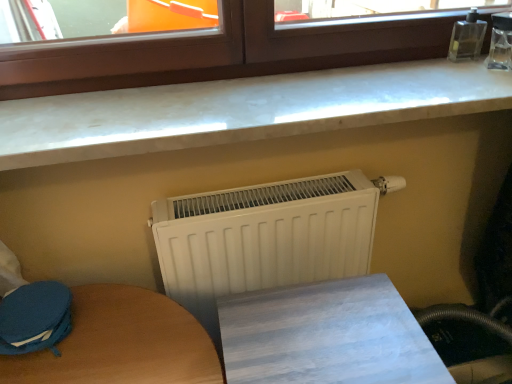
The image size is (512, 384). Find the location of `free point above white marble countertop at upper center (from a real-world perspective)`. free point above white marble countertop at upper center (from a real-world perspective) is located at coordinates (285, 94).